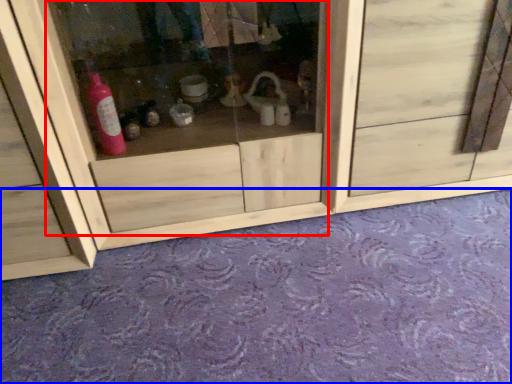
Question: Which object is further to the camera taking this photo, glass door (highlighted by a red box) or plain (highlighted by a blue box)?

Choices:
 (A) glass door
 (B) plain

Answer: (A)